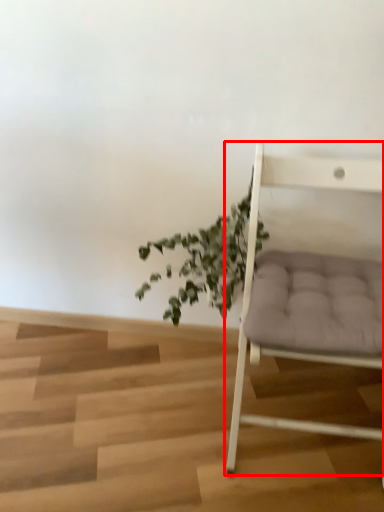
Question: In this image, where is chair (annotated by the red box) located relative to houseplant?

Choices:
 (A) left
 (B) right

Answer: (B)